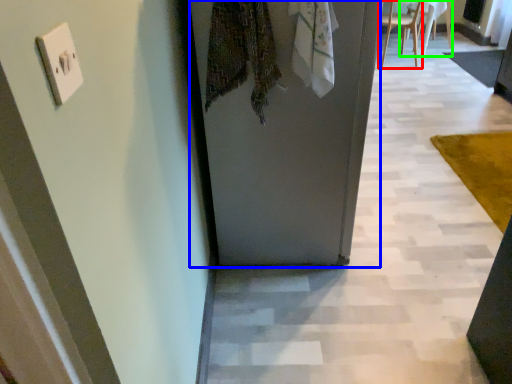
Question: Which object is the farthest from chair (highlighted by a red box)? Choose among these: door (highlighted by a blue box) or chair (highlighted by a green box).

Choices:
 (A) door
 (B) chair

Answer: (A)